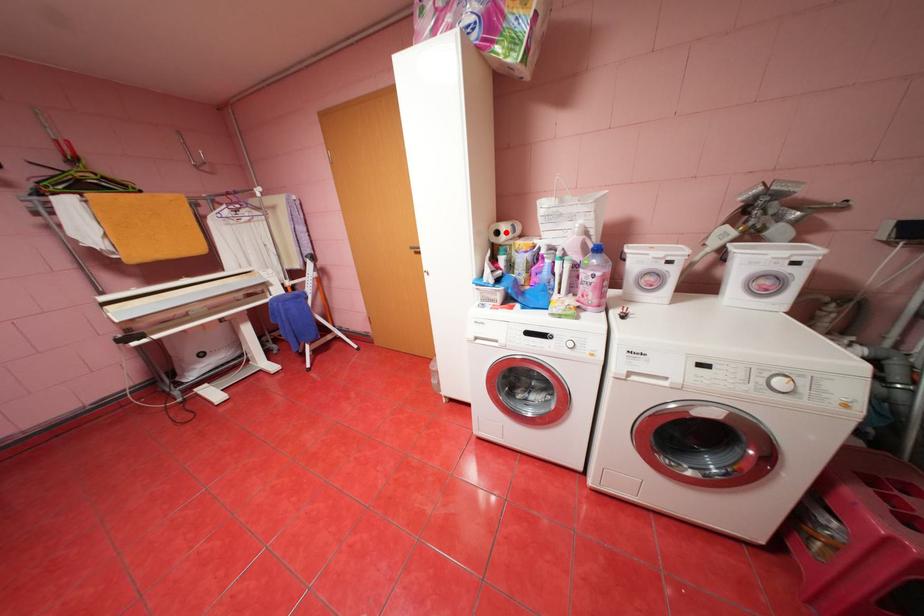
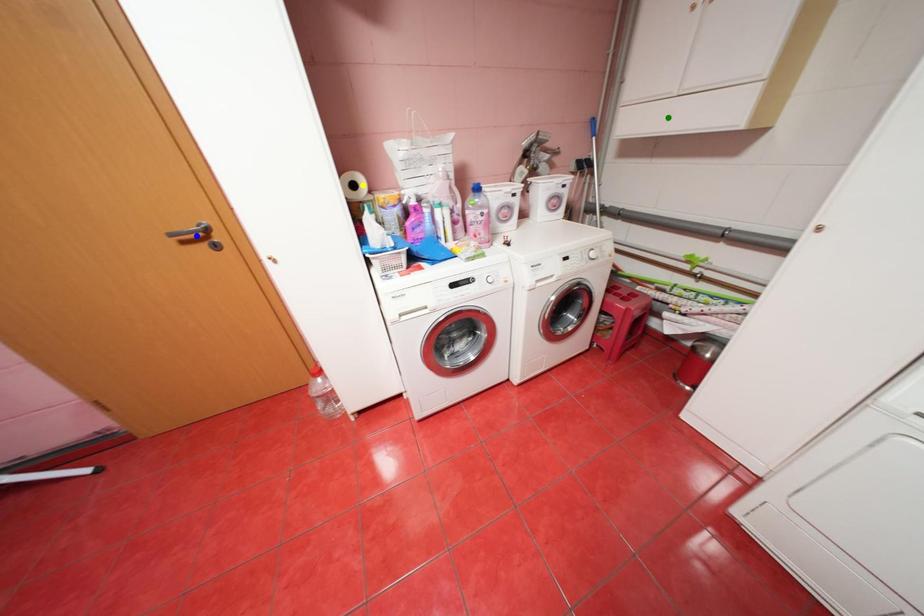
Question: I am providing you with two images of the same scene from different viewpoints. A red point is marked on the first image. You are given multiple points on the second image. Which point in image 2 represents the same 3d spot as the red point in image 1?

Choices:
 (A) blue point
 (B) yellow point
 (C) green point

Answer: (B)